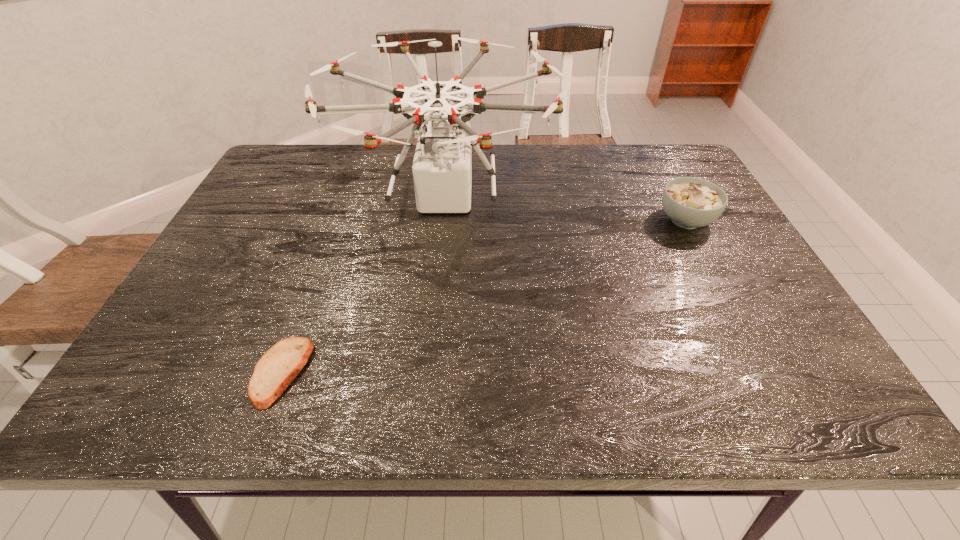
The image size is (960, 540). I want to click on the tallest object, so click(442, 167).

In order to click on the second tallest object in this screenshot , I will do [x=689, y=202].

Where is `the rightmost object`? the rightmost object is located at coordinates (689, 202).

Identify the location of the shortest object. The image size is (960, 540). (278, 367).

Where is `pita bread`? pita bread is located at coordinates (278, 367).

In order to click on free region located on the right of the tallest object in this screenshot , I will do `click(614, 198)`.

Identify the location of free space located on the front of the soup bowl. This screenshot has height=540, width=960. (711, 269).

Identify the location of free region located 0.310m on the back of the nearest object. This screenshot has height=540, width=960. (331, 238).

This screenshot has height=540, width=960. Find the location of `object at the far edge`. object at the far edge is located at coordinates (442, 167).

This screenshot has height=540, width=960. In order to click on object that is at the near edge in this screenshot , I will do `click(278, 367)`.